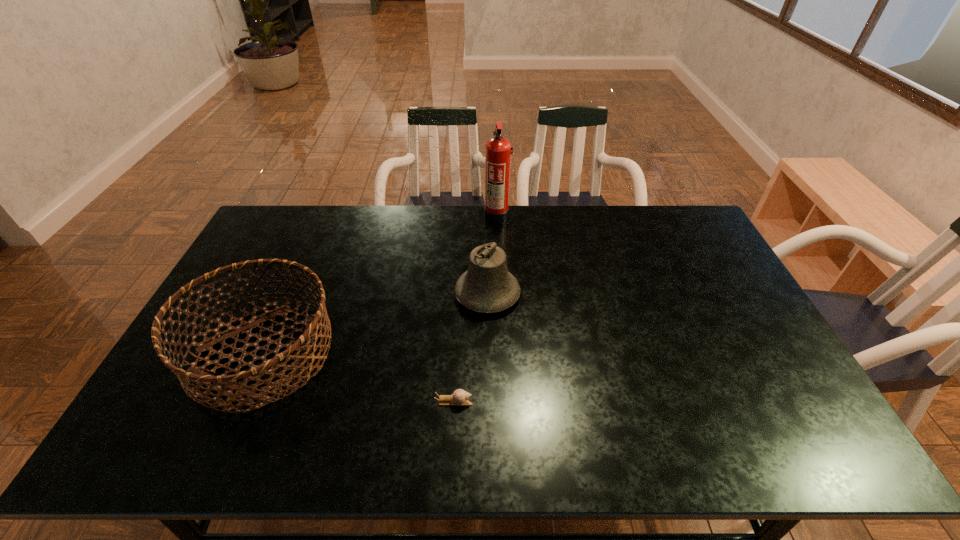
Find the location of a particular element. The height and width of the screenshot is (540, 960). vacant space situated 0.220m on the shell of the escargot is located at coordinates (561, 401).

Where is `object present at the far edge`? The width and height of the screenshot is (960, 540). object present at the far edge is located at coordinates (498, 152).

Where is `object located in the left edge section of the desktop`? object located in the left edge section of the desktop is located at coordinates (303, 344).

Image resolution: width=960 pixels, height=540 pixels. I want to click on vacant space at the far edge of the desktop, so click(545, 214).

The width and height of the screenshot is (960, 540). In the image, there is a desktop. In order to click on blank space at the near edge in this screenshot , I will do `click(635, 448)`.

The height and width of the screenshot is (540, 960). Identify the location of vacant space at the left edge of the desktop. coord(146,418).

Find the location of a particular element. This screenshot has height=540, width=960. vacant space at the far left corner of the desktop is located at coordinates (295, 212).

This screenshot has height=540, width=960. Identify the location of free space at the far right corner. (666, 242).

Find the location of a particular element. The height and width of the screenshot is (540, 960). free point between the leftmost object and the escargot is located at coordinates (358, 377).

Find the location of `free space that is in between the escargot and the bell`. free space that is in between the escargot and the bell is located at coordinates (470, 348).